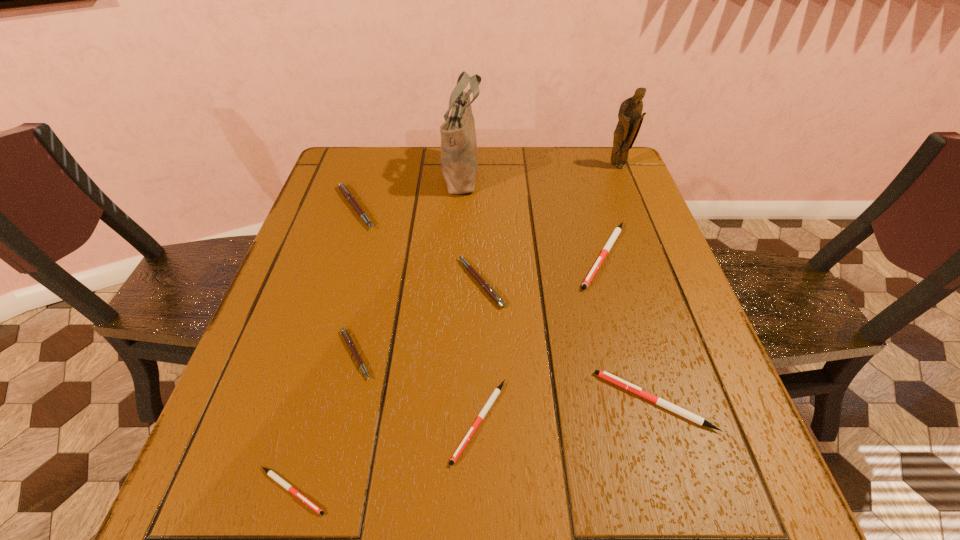
Locate an element on the screen. Image resolution: width=960 pixels, height=540 pixels. the smallest white pen is located at coordinates (287, 486).

Locate an element on the screen. This screenshot has width=960, height=540. the shortest pen is located at coordinates (287, 486).

Find the location of a particular element. free space located 0.400m on the front-facing side of the tallest object is located at coordinates (618, 172).

Locate an element on the screen. vacant area situated 0.210m on the front-facing side of the figurine is located at coordinates (636, 215).

Where is `blank space located at the nib of the biggest pink pen`? blank space located at the nib of the biggest pink pen is located at coordinates (398, 208).

Where is `vacant space situated 0.110m on the clicker of the farthest white pen`? The height and width of the screenshot is (540, 960). vacant space situated 0.110m on the clicker of the farthest white pen is located at coordinates (625, 332).

Locate an element on the screen. vacant area situated 0.170m at the nib of the second smallest pink pen is located at coordinates (381, 282).

Image resolution: width=960 pixels, height=540 pixels. I want to click on vacant space situated at the nib of the second smallest pink pen, so click(x=368, y=282).

The width and height of the screenshot is (960, 540). I want to click on free space located at the nib of the second smallest pink pen, so click(372, 282).

Where is `free space located 0.330m on the clicker of the third smallest white pen`? free space located 0.330m on the clicker of the third smallest white pen is located at coordinates (413, 401).